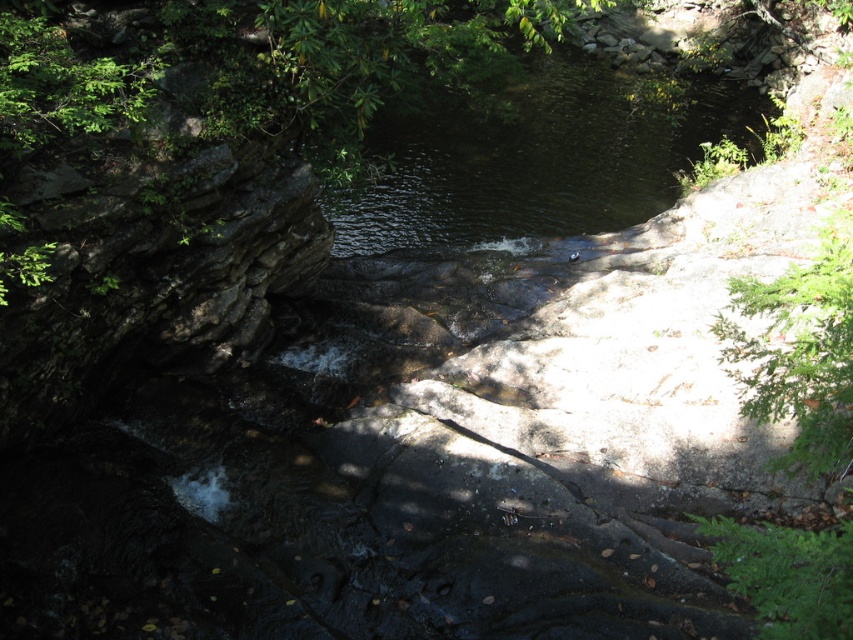
Between green leafy tree at upper center and dark green water at center, which one appears on the right side from the viewer's perspective?

From the viewer's perspective, dark green water at center appears more on the right side.

Is point (247, 129) less distant than point (442, 212)?

Yes, it is in front of point (442, 212).

Find the location of a particular element. This screenshot has width=853, height=640. green leafy tree at upper center is located at coordinates (250, 64).